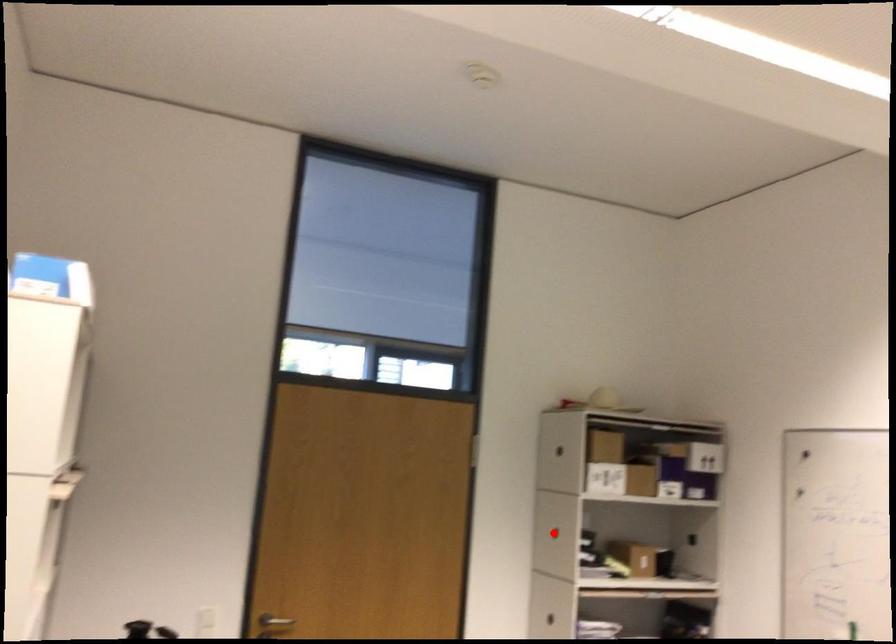
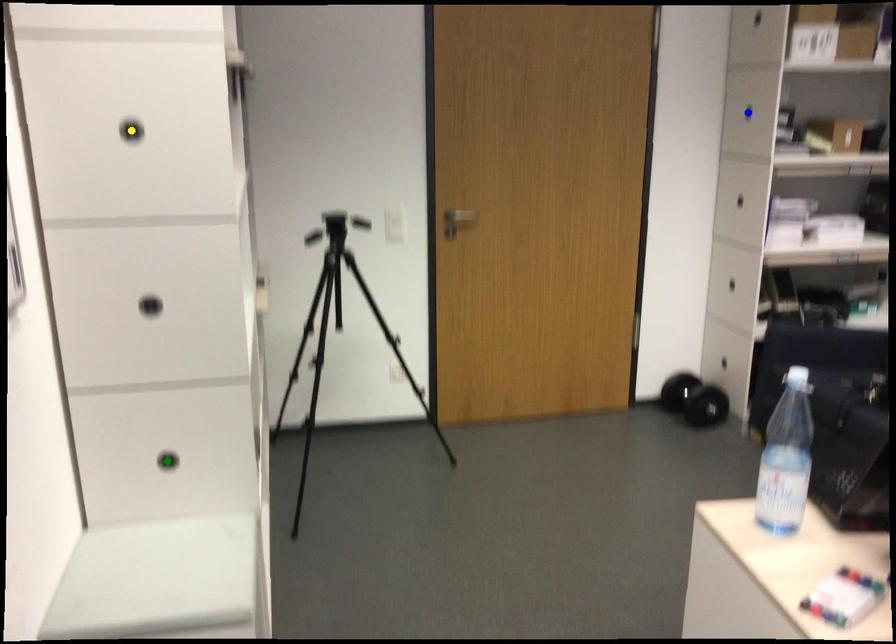
Question: I am providing you with two images of the same scene from different viewpoints. A red point is marked on the first image. You are given multiple points on the second image. Which point in image 2 represents the same 3d spot as the red point in image 1?

Choices:
 (A) blue point
 (B) yellow point
 (C) green point

Answer: (A)